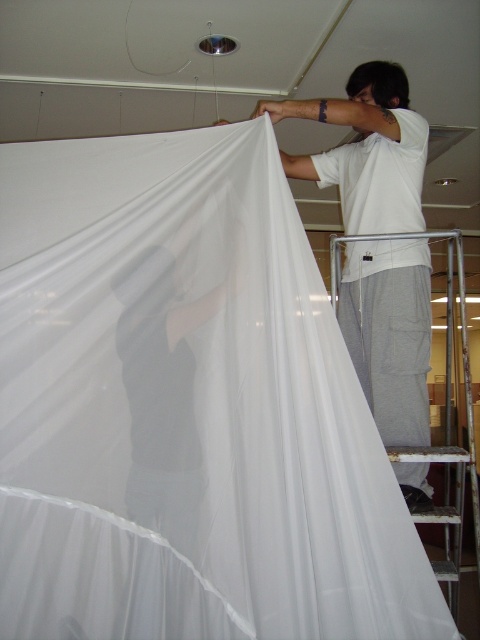
You are an interior designer trying to hang a new curtain. You have a white sheer fabric at upper right and a black fabric at center. Which fabric is positioned more to the right side of the room?

The white sheer fabric at upper right is positioned more to the right side of the room compared to the black fabric at center.

You are an interior designer who needs to choose between the white sheer fabric at upper right and the black fabric at center for a window treatment project. Based on their sizes, which fabric would you recommend to cover a wider area?

The white sheer fabric at upper right has a larger width than the black fabric at center, so it would be better suited to cover a wider area.